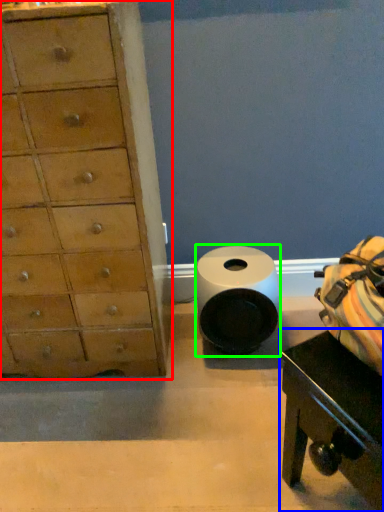
Question: Based on their relative distances, which object is farther from chest of drawers (highlighted by a red box)? Choose from table (highlighted by a blue box) and toilet paper (highlighted by a green box).

Choices:
 (A) table
 (B) toilet paper

Answer: (A)